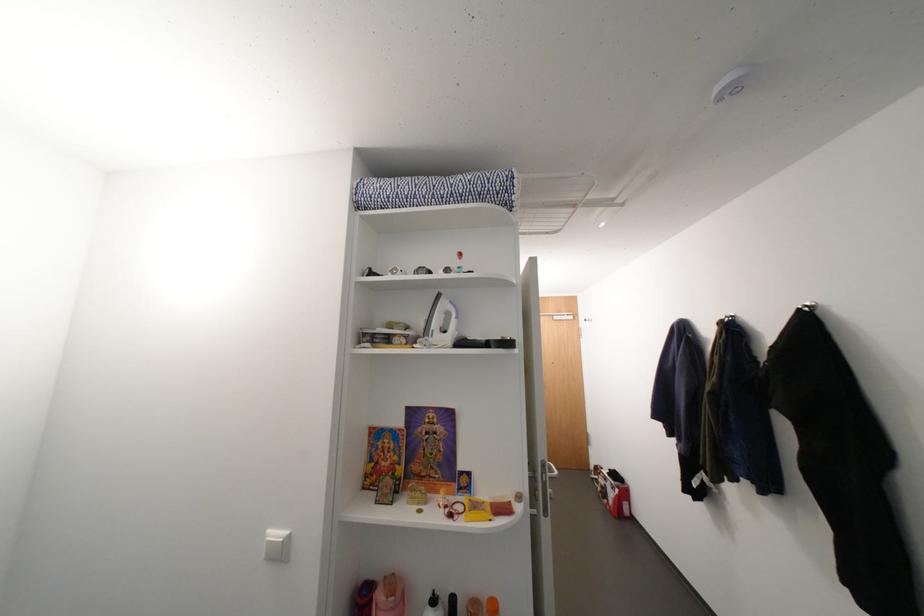
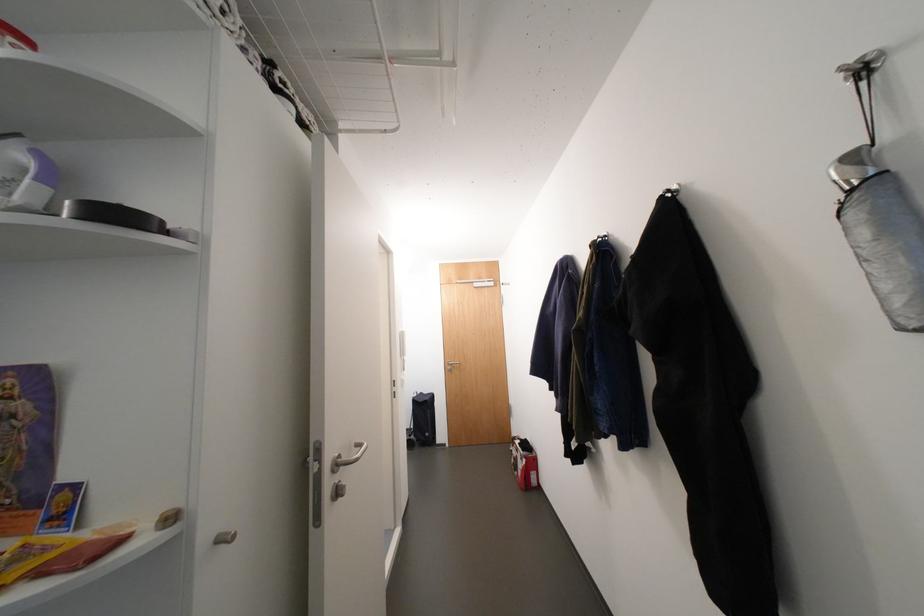
Locate, in the second image, the point that corresponds to the point at 618,501 in the first image.

(527, 474)